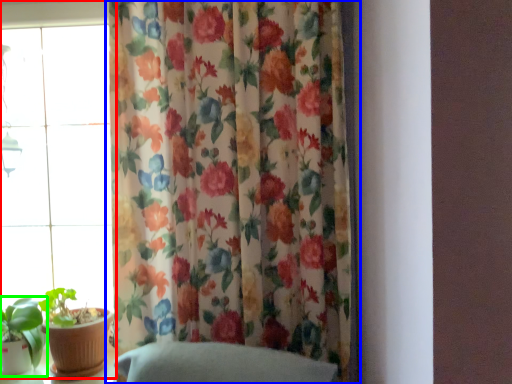
Question: Estimate the real-world distances between objects in this image. Which object is closer to window (highlighted by a red box), curtain (highlighted by a blue box) or houseplant (highlighted by a green box)?

Choices:
 (A) curtain
 (B) houseplant

Answer: (B)